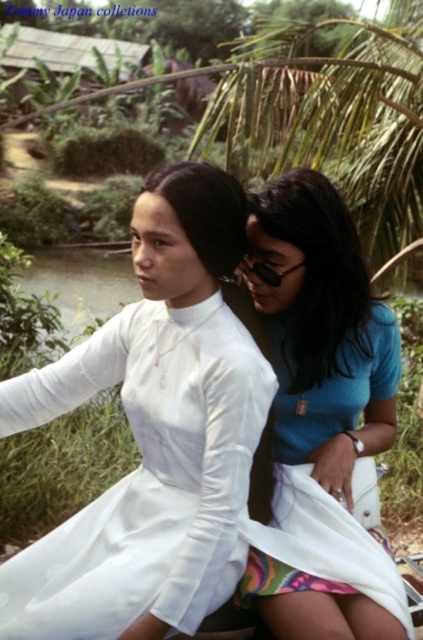
You are standing in a tropical garden and see a white satin dress at center. If you want to reach it, how many steps do you need to take if each step covers 1.3 feet?

The distance between you and the white satin dress at center is 3.90 feet. Since each step covers 1.3 feet, you would need to take 3 steps to reach it.

You are a photographer who wants to take a closeup shot of the white satin dress at center. According to the coordinates provided, where should you aim your camera?

The white satin dress at center is located at coordinates point (x=145, y=476), so the photographer should aim their camera at that point to capture the dress.